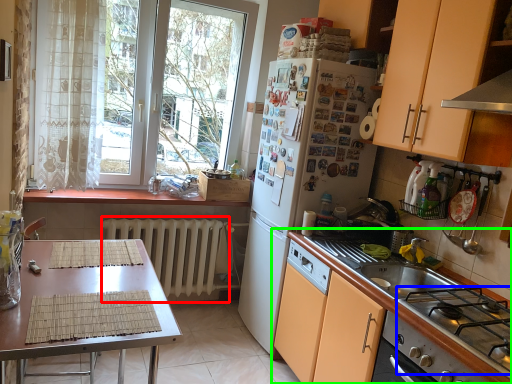
Question: Which object is positioned farthest from radiator (highlighted by a red box)? Select from gas stove (highlighted by a blue box) and cabinetry (highlighted by a green box).

Choices:
 (A) gas stove
 (B) cabinetry

Answer: (A)